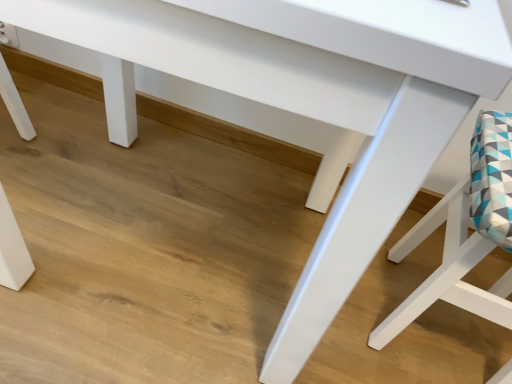
This screenshot has width=512, height=384. Identify the location of white glossy chair at lower right. (449, 268).

Describe the element at coordinates (449, 268) in the screenshot. I see `white glossy chair at lower right` at that location.

The image size is (512, 384). I want to click on white glossy chair at lower right, so click(449, 268).